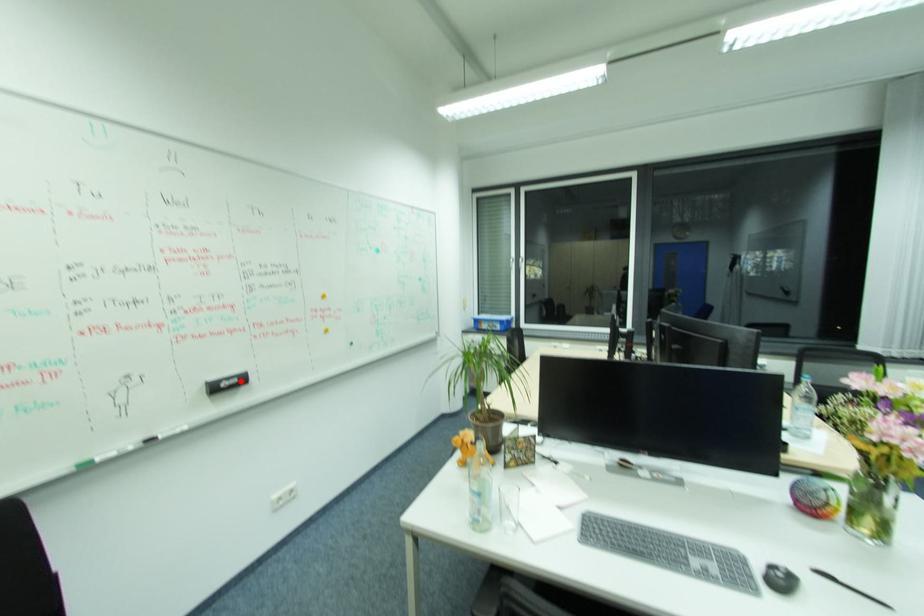
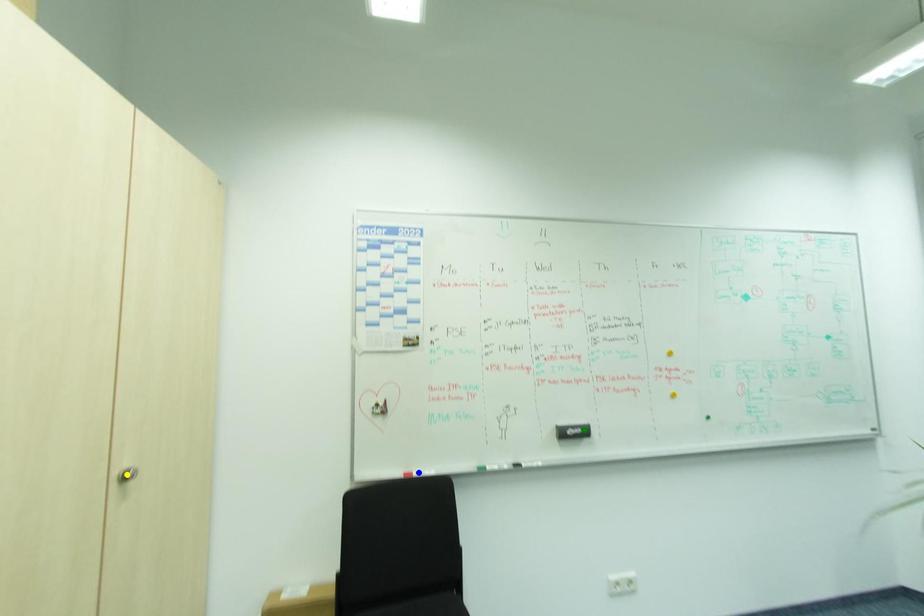
Question: I am providing you with two images of the same scene from different viewpoints. A red point is marked on the first image. You are given multiple points on the second image. Which point in image 2 is actually the same real-world point as the red point in image 1?

Choices:
 (A) blue point
 (B) yellow point
 (C) green point

Answer: (C)